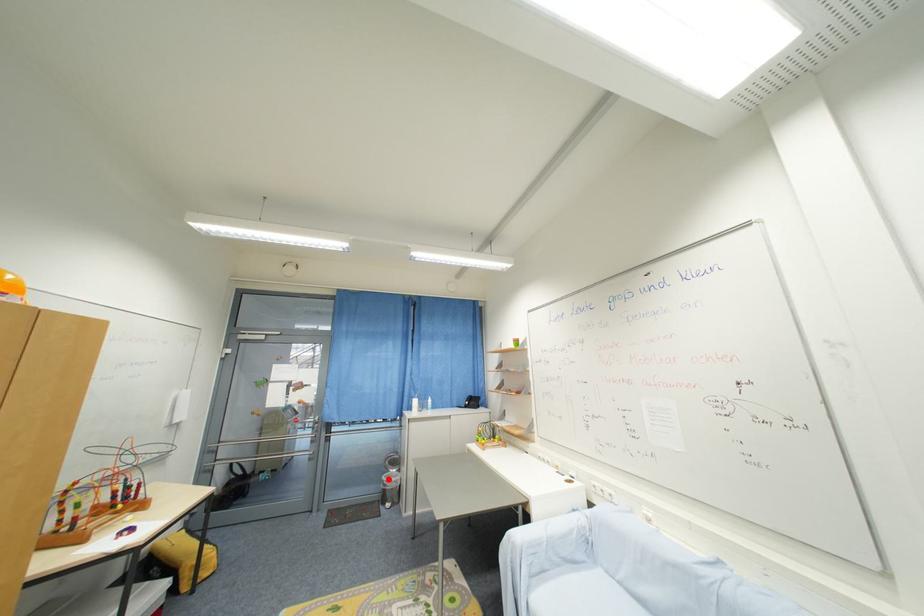
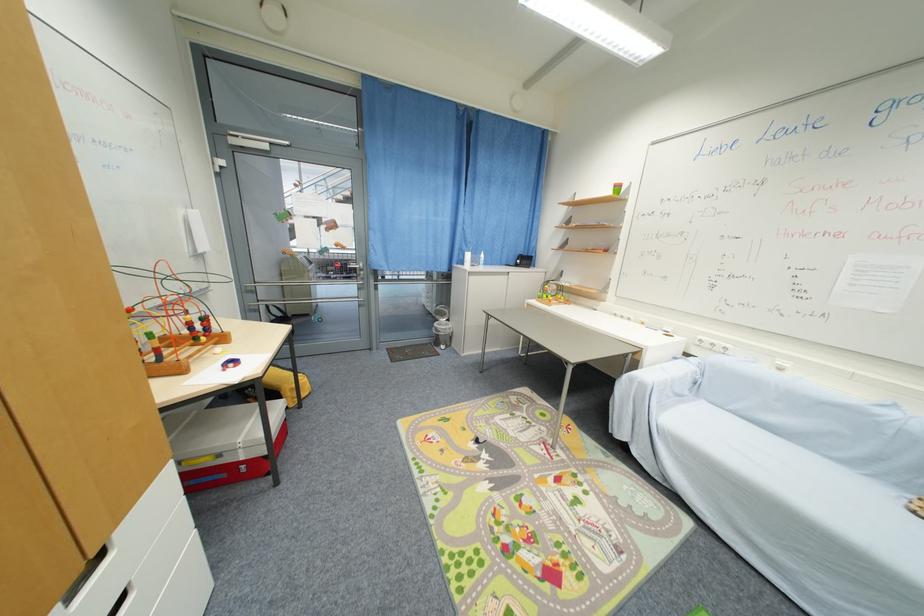
Question: I am providing you with two images of the same scene from different viewpoints. A red point is marked on the first image. Is the red point's position out of view in image 2?

Choices:
 (A) Yes
 (B) No

Answer: (B)